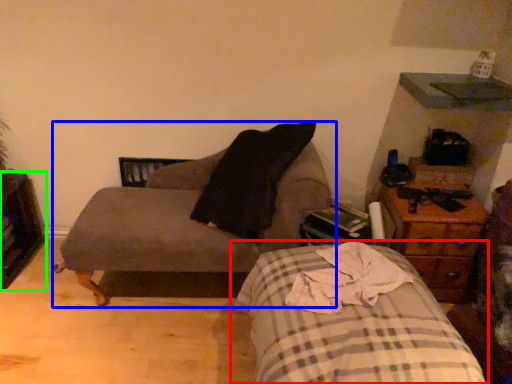
Question: Which object is positioned farthest from bed (highlighted by a red box)? Select from chair (highlighted by a blue box) and dresser (highlighted by a green box).

Choices:
 (A) chair
 (B) dresser

Answer: (B)